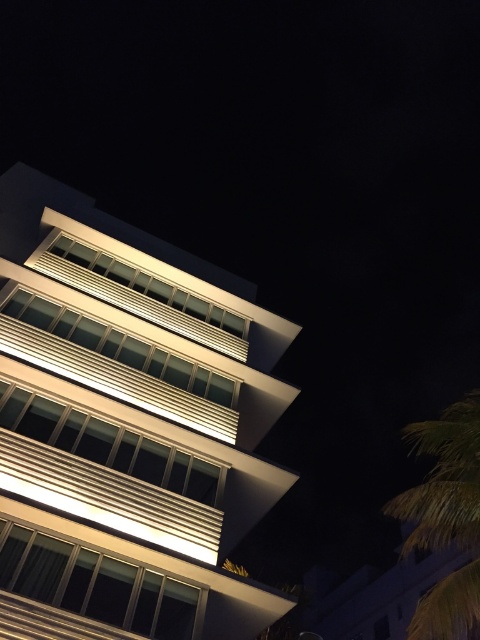
Is white glossy building at center wider than green leafy palm tree at lower right?

Incorrect, white glossy building at center's width does not surpass green leafy palm tree at lower right's.

Who is more forward, [245,429] or [459,428]?

Point [459,428]

Which is in front, point (134, 410) or point (432, 442)?

Positioned in front is point (134, 410).

Locate an element on the screen. This screenshot has width=480, height=640. white glossy building at center is located at coordinates (128, 428).